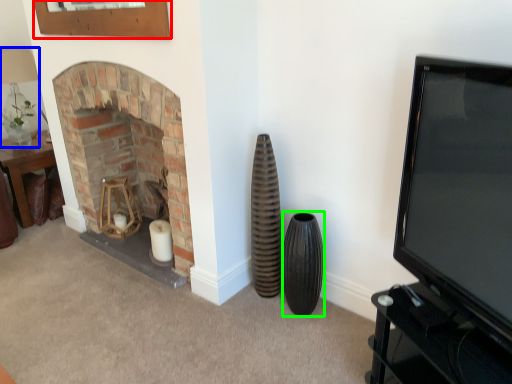
Question: Considering the real-world distances, which object is closest to picture frame (highlighted by a red box)? lamp (highlighted by a blue box) or vase (highlighted by a green box).

Choices:
 (A) lamp
 (B) vase

Answer: (A)